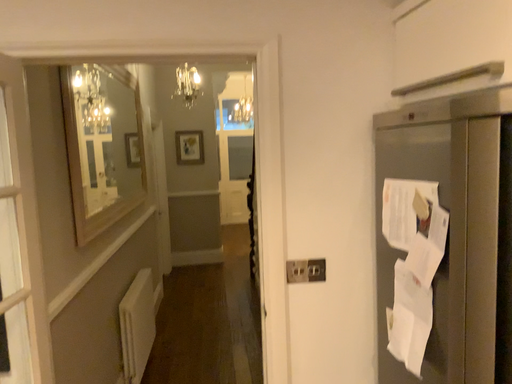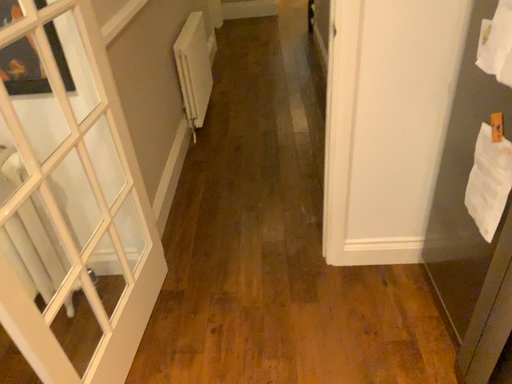
Question: How did the camera likely rotate when shooting the video?

Choices:
 (A) rotated upward
 (B) rotated downward

Answer: (B)